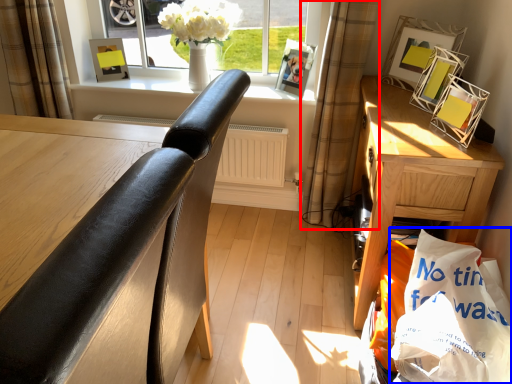
Question: Which object is further to the camera taking this photo, curtain (highlighted by a red box) or shopping bag (highlighted by a blue box)?

Choices:
 (A) curtain
 (B) shopping bag

Answer: (A)